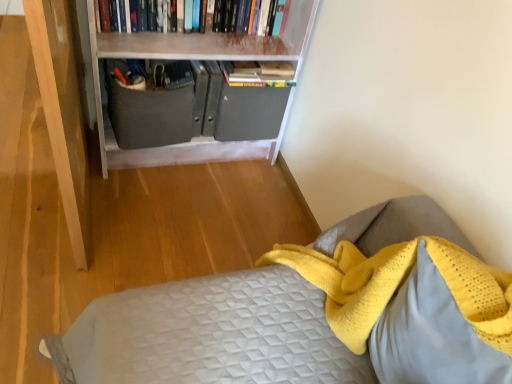
Find the location of `free spot above matte gray drawer at center (from a real-world perspective)`. free spot above matte gray drawer at center (from a real-world perspective) is located at coordinates (139, 67).